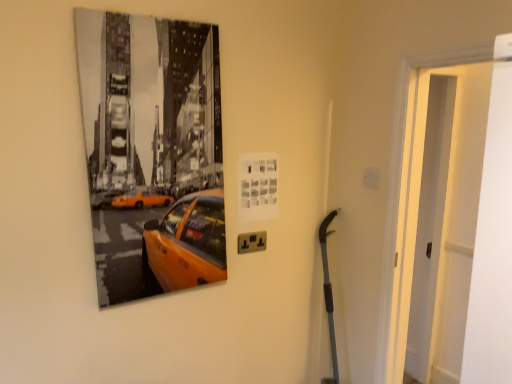
Question: Considering the positions of black plastic/socket at lower center and white matte door at right in the image, is black plastic/socket at lower center bigger or smaller than white matte door at right?

Choices:
 (A) small
 (B) big

Answer: (A)

Question: From a real-world perspective, is black plastic/socket at lower center physically located above or below white matte door at right?

Choices:
 (A) below
 (B) above

Answer: (A)

Question: Relative to white matte door at right, is black plastic/socket at lower center in front or behind?

Choices:
 (A) front
 (B) behind

Answer: (B)

Question: From the image's perspective, is white matte door at right positioned above or below black plastic/socket at lower center?

Choices:
 (A) below
 (B) above

Answer: (B)

Question: Is white matte door at right spatially inside black plastic/socket at lower center, or outside of it?

Choices:
 (A) outside
 (B) inside

Answer: (A)

Question: Based on their positions, is white matte door at right located to the left or right of black plastic/socket at lower center?

Choices:
 (A) left
 (B) right

Answer: (B)

Question: Is white matte door at right in front of or behind black plastic/socket at lower center in the image?

Choices:
 (A) behind
 (B) front

Answer: (B)